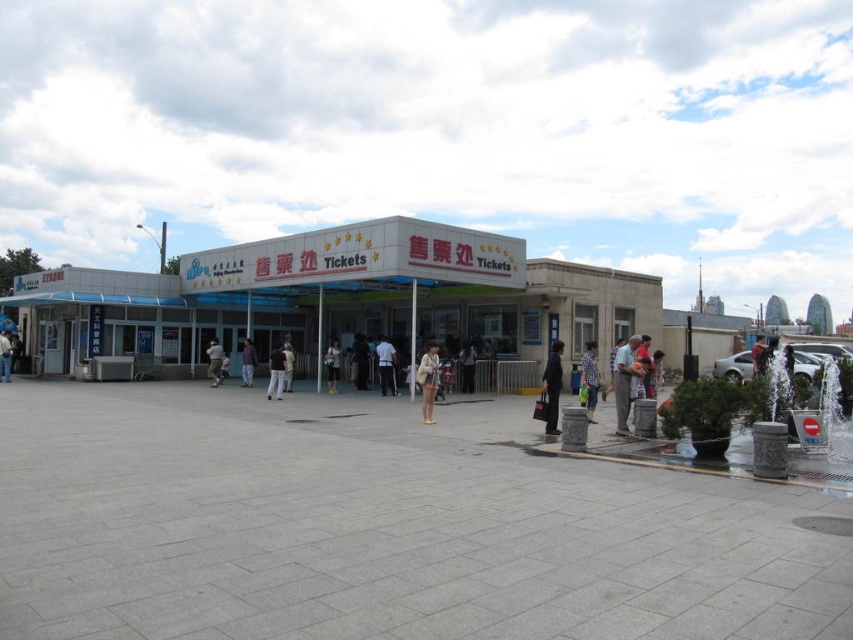
Question: Is white matte shirt at center further to camera compared to light brown fabric shirt at center?

Choices:
 (A) yes
 (B) no

Answer: (A)

Question: Which object appears farthest from the camera in this image?

Choices:
 (A) light brown fabric shirt at center
 (B) gray concrete plaza at center
 (C) light brown leather jacket at center
 (D) dark gray fabric jacket at center

Answer: (C)

Question: Which point is closer to the camera taking this photo?

Choices:
 (A) (622, 381)
 (B) (364, 346)
 (C) (463, 355)

Answer: (A)

Question: Does blue cotton shirt at center lie in front of light brown leather jacket at center?

Choices:
 (A) yes
 (B) no

Answer: (A)

Question: Which object is the farthest from the light brown fabric bag at center?

Choices:
 (A) purple fabric jacket at center
 (B) black cotton pants at center

Answer: (A)

Question: Does dark gray fabric jacket at center have a greater width compared to purple fabric jacket at center?

Choices:
 (A) yes
 (B) no

Answer: (B)